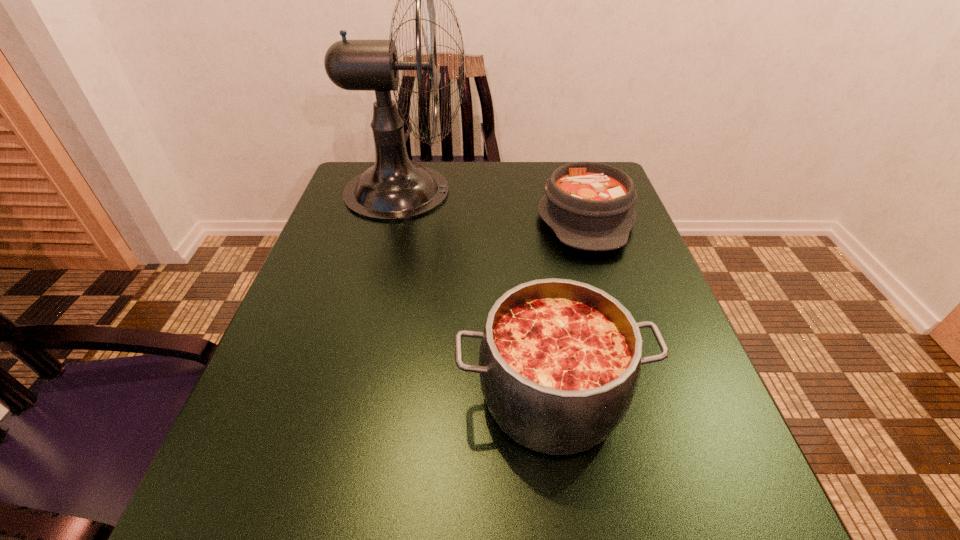
Locate an element on the screen. The width and height of the screenshot is (960, 540). free space that satisfies the following two spatial constraints: 1. on the back side of the taller casserole; 2. on the left side of the shorter casserole is located at coordinates (527, 219).

You are a GUI agent. You are given a task and a screenshot of the screen. Output one action in this format:
    pyautogui.click(x=<x>, y=<y>)
    Task: Click on the vacant space that satisfies the following two spatial constraints: 1. on the front-facing side of the fan; 2. on the left side of the shorter casserole
    
    Given the screenshot: What is the action you would take?
    pyautogui.click(x=399, y=219)

At what (x,y) coordinates should I click in order to perform the action: click on free space that satisfies the following two spatial constraints: 1. on the front-facing side of the tallest object; 2. on the right side of the second shortest object. Please return your answer as a coordinate pair (x, y). The height and width of the screenshot is (540, 960). Looking at the image, I should click on (358, 395).

You are a GUI agent. You are given a task and a screenshot of the screen. Output one action in this format:
    pyautogui.click(x=<x>, y=<y>)
    Task: Click on the free space that satisfies the following two spatial constraints: 1. on the front-facing side of the fan; 2. on the right side of the shorter casserole
    Image resolution: width=960 pixels, height=540 pixels.
    Given the screenshot: What is the action you would take?
    pyautogui.click(x=399, y=219)

I want to click on free location that satisfies the following two spatial constraints: 1. on the front-facing side of the fan; 2. on the back side of the nearer casserole, so click(358, 395).

Where is `vacant region that satisfies the following two spatial constraints: 1. on the front-facing side of the shorter casserole; 2. on the right side of the tallest object`? The height and width of the screenshot is (540, 960). vacant region that satisfies the following two spatial constraints: 1. on the front-facing side of the shorter casserole; 2. on the right side of the tallest object is located at coordinates (399, 219).